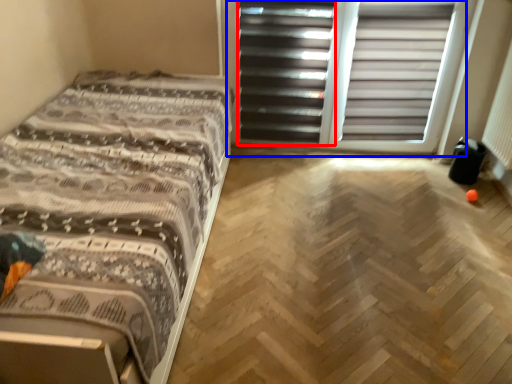
Question: Which object appears closest to the camera in this image, screen door (highlighted by a red box) or screen door (highlighted by a blue box)?

Choices:
 (A) screen door
 (B) screen door

Answer: (B)